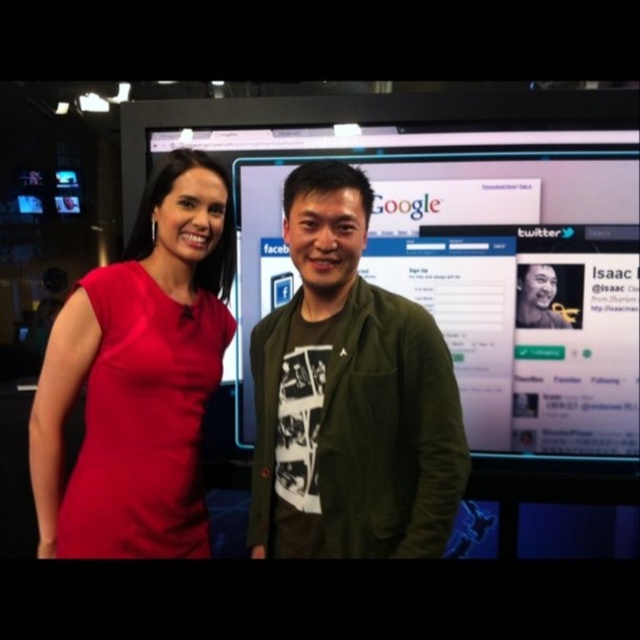
In the scene shown: Does green textured jacket at center appear on the left side of matte red dress at left?

No, green textured jacket at center is not to the left of matte red dress at left.

Is green textured jacket at center closer to the viewer compared to matte red dress at left?

Yes, green textured jacket at center is closer to the viewer.

What do you see at coordinates (349, 396) in the screenshot? I see `green textured jacket at center` at bounding box center [349, 396].

You are a GUI agent. You are given a task and a screenshot of the screen. Output one action in this format:
    pyautogui.click(x=<x>, y=<y>)
    Task: Click on the green textured jacket at center
    
    Given the screenshot: What is the action you would take?
    pyautogui.click(x=349, y=396)